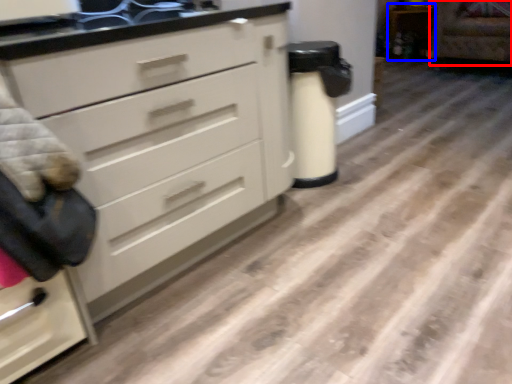
Question: Which object appears farthest to the camera in this image, armchair (highlighted by a red box) or cabinetry (highlighted by a blue box)?

Choices:
 (A) armchair
 (B) cabinetry

Answer: (B)